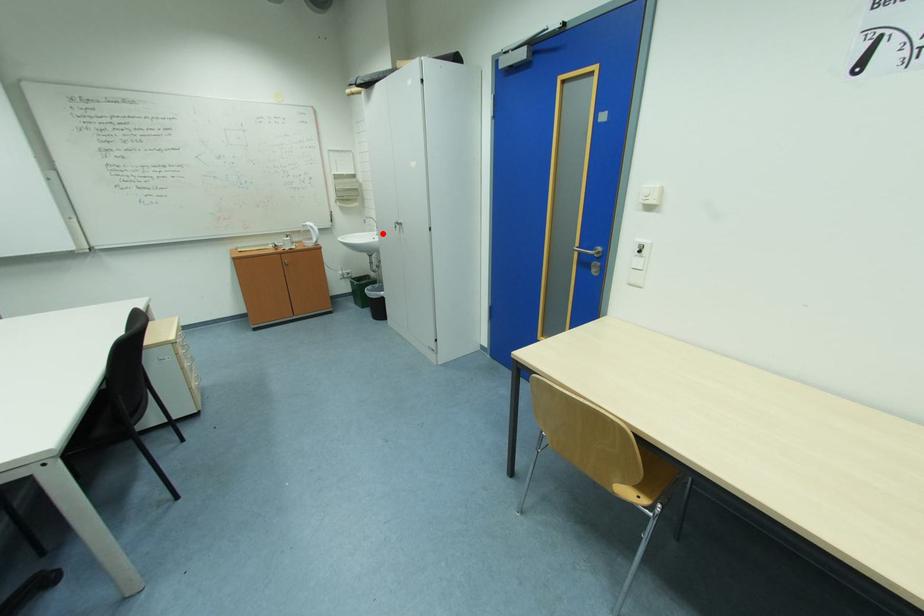
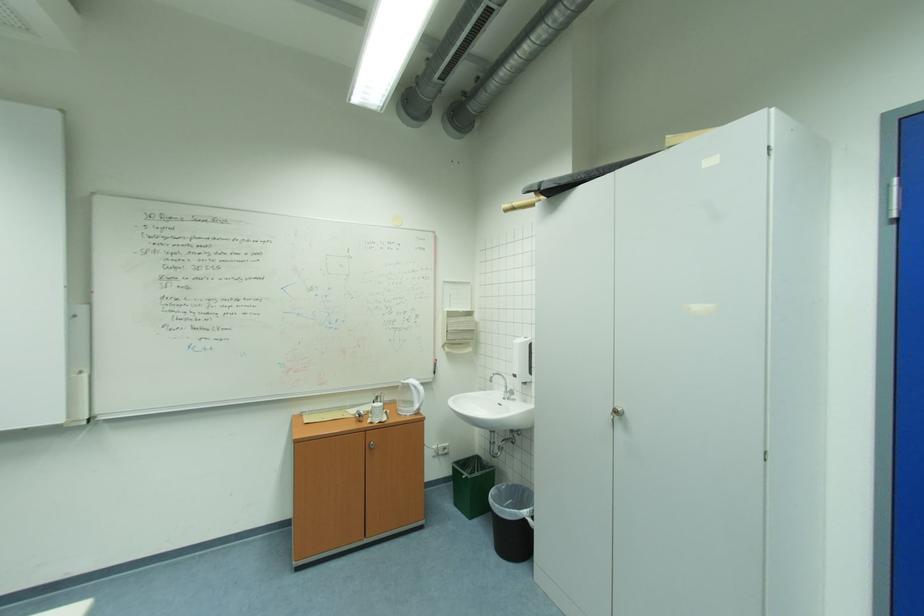
Locate, in the second image, the point that corresponds to the highlighted location in the first image.

(506, 394)